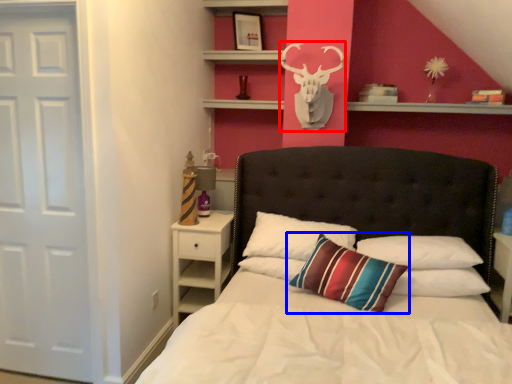
Question: Which object appears closest to the camera in this image, deer (highlighted by a red box) or pillow (highlighted by a blue box)?

Choices:
 (A) deer
 (B) pillow

Answer: (B)